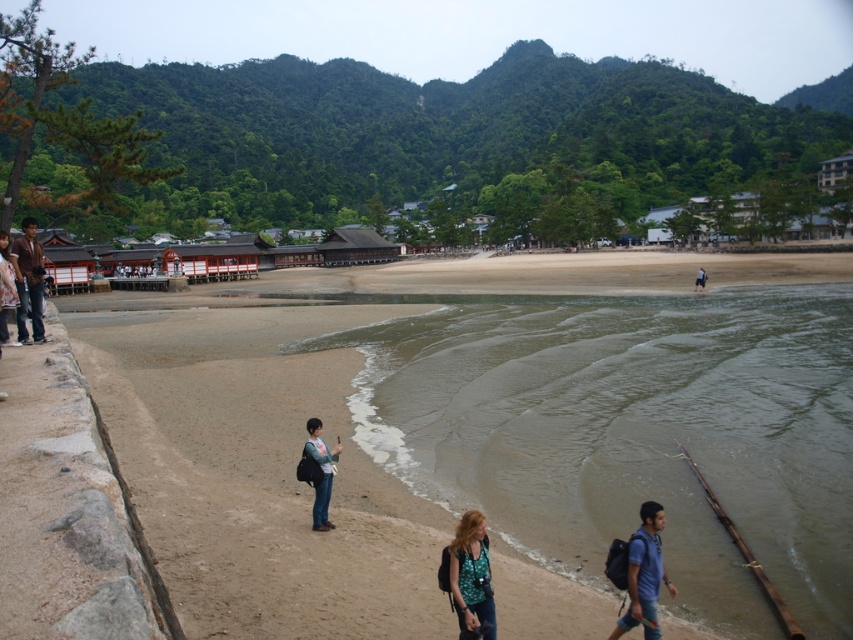
Question: Is sandy beach at lower left thinner than green patterned shirt at lower center?

Choices:
 (A) yes
 (B) no

Answer: (B)

Question: Estimate the real-world distances between objects in this image. Which object is closer to the denim pants at lower center?

Choices:
 (A) sandy beach at lower left
 (B) light blue denim jeans at lower center

Answer: (A)

Question: Considering the real-world distances, which object is farthest from the blue denim jeans at lower right?

Choices:
 (A) green patterned shirt at lower center
 (B) matte brown jacket at left
 (C) dark blue jeans at lower left
 (D) sandy beach at lower left

Answer: (D)

Question: Is green patterned shirt at lower center above denim pants at lower center?

Choices:
 (A) no
 (B) yes

Answer: (A)

Question: Which object is the farthest from the light blue denim jeans at lower center?

Choices:
 (A) blue denim jeans at lower right
 (B) green patterned shirt at lower center
 (C) denim pants at lower center

Answer: (B)

Question: In this image, where is blue denim jeans at lower right located relative to denim pants at lower center?

Choices:
 (A) right
 (B) left

Answer: (A)